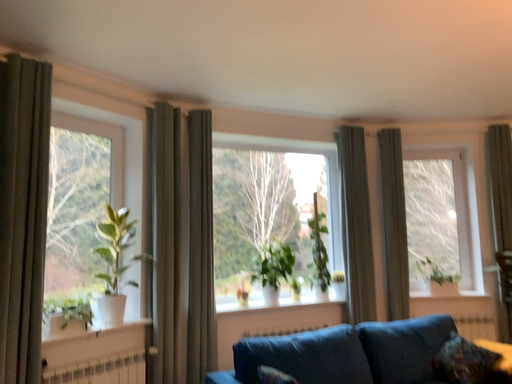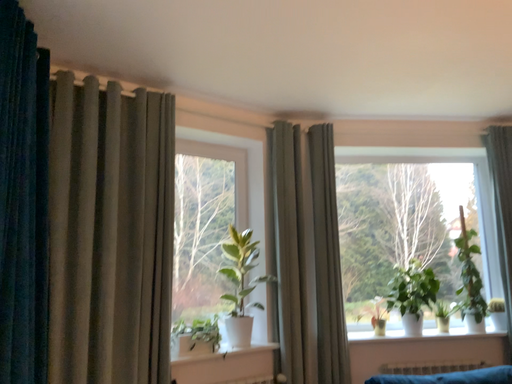
Question: Which way did the camera rotate in the video?

Choices:
 (A) rotated left
 (B) rotated right

Answer: (A)